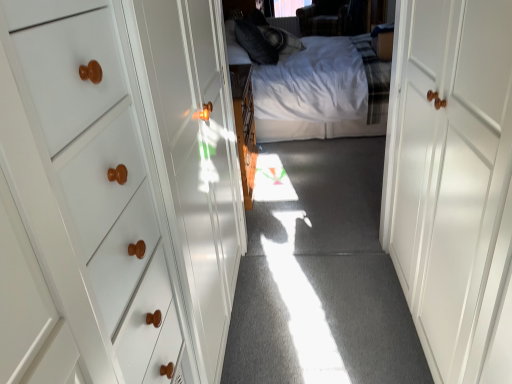
What is the approximate width of white glossy door at right?

It is 60.56 centimeters.

This screenshot has height=384, width=512. Describe the element at coordinates (453, 183) in the screenshot. I see `white glossy door at right` at that location.

You are a GUI agent. You are given a task and a screenshot of the screen. Output one action in this format:
    pyautogui.click(x=<x>, y=<y>)
    Task: Click on the white glossy door at right
    
    Given the screenshot: What is the action you would take?
    pyautogui.click(x=453, y=183)

I want to click on white cotton bed at center, so click(321, 92).

What do you see at coordinates (321, 92) in the screenshot?
I see `white cotton bed at center` at bounding box center [321, 92].

Identify the location of white glossy door at right. The height and width of the screenshot is (384, 512). (453, 183).

Does white cotton bed at center appear on the left side of white glossy door at right?

Yes.

Which is behind, white cotton bed at center or white glossy door at right?

white cotton bed at center is behind.

Does point (310, 121) lie behind point (509, 21)?

That is True.

From the image's perspective, would you say white cotton bed at center is positioned over white glossy door at right?

Correct, white cotton bed at center appears higher than white glossy door at right in the image.

Based on the photo, from a real-world perspective, does white cotton bed at center stand above white glossy door at right?

Incorrect, from a real-world perspective, white cotton bed at center is lower than white glossy door at right.

Considering the relative sizes of white cotton bed at center and white glossy door at right in the image provided, is white cotton bed at center wider than white glossy door at right?

Yes.

Considering the sizes of white cotton bed at center and white glossy door at right in the image, is white cotton bed at center taller or shorter than white glossy door at right?

white cotton bed at center is taller than white glossy door at right.

Can you confirm if white cotton bed at center is bigger than white glossy door at right?

Correct, white cotton bed at center is larger in size than white glossy door at right.

Do you think white cotton bed at center is within white glossy door at right, or outside of it?

white cotton bed at center cannot be found inside white glossy door at right.

Is white cotton bed at center positioned far away from white glossy door at right?

That's right, there is a large distance between white cotton bed at center and white glossy door at right.

Could you tell me if white cotton bed at center is facing white glossy door at right?

No, white cotton bed at center does not turn towards white glossy door at right.

Can you tell me how much white cotton bed at center and white glossy door at right differ in facing direction?

They differ by 180 degrees in their facing directions.

The height and width of the screenshot is (384, 512). What are the coordinates of `bed located above the white glossy door at right (from the image's perspective)` in the screenshot? It's located at (321, 92).

Considering the positions of objects white glossy door at right and white cotton bed at center in the image provided, who is more to the left, white glossy door at right or white cotton bed at center?

From the viewer's perspective, white cotton bed at center appears more on the left side.

Which object is closer to the camera, white glossy door at right or white cotton bed at center?

white glossy door at right is in front.

Does point (422, 341) lie in front of point (309, 138)?

That is True.

From the image's perspective, which is above, white glossy door at right or white cotton bed at center?

white cotton bed at center appears higher in the image.

From a real-world perspective, is white glossy door at right located beneath white cotton bed at center?

No, from a real-world perspective, white glossy door at right is not beneath white cotton bed at center.

In the scene shown: Considering the sizes of objects white glossy door at right and white cotton bed at center in the image provided, who is wider, white glossy door at right or white cotton bed at center?

Wider between the two is white cotton bed at center.

Is white glossy door at right shorter than white cotton bed at center?

Yes, white glossy door at right is shorter than white cotton bed at center.

Looking at the image, does white glossy door at right seem bigger or smaller compared to white cotton bed at center?

Clearly, white glossy door at right is smaller in size than white cotton bed at center.

Is white glossy door at right completely or partially outside of white cotton bed at center?

Yes, white glossy door at right is outside of white cotton bed at center.

Looking at this image, can you see white glossy door at right touching white cotton bed at center?

white glossy door at right and white cotton bed at center are clearly separated.

Is white glossy door at right positioned with its back to white cotton bed at center?

white glossy door at right is not turned away from white cotton bed at center.

How different are the orientations of white glossy door at right and white cotton bed at center in degrees?

The facing directions of white glossy door at right and white cotton bed at center are 180 degrees apart.

How distant is white glossy door at right from white cotton bed at center?

white glossy door at right is 6.56 feet from white cotton bed at center.

Where is `bed located on the left of white glossy door at right`? This screenshot has height=384, width=512. bed located on the left of white glossy door at right is located at coordinates (321, 92).

Where is `bed that is under the white glossy door at right (from a real-world perspective)`? bed that is under the white glossy door at right (from a real-world perspective) is located at coordinates (321, 92).

Locate an element on the screen. The image size is (512, 384). door on the right of white cotton bed at center is located at coordinates (453, 183).